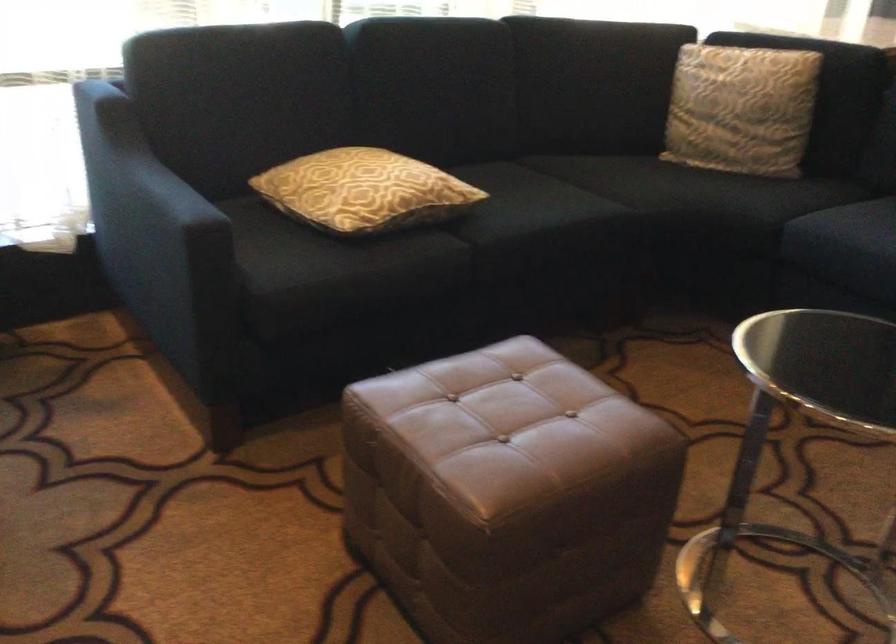
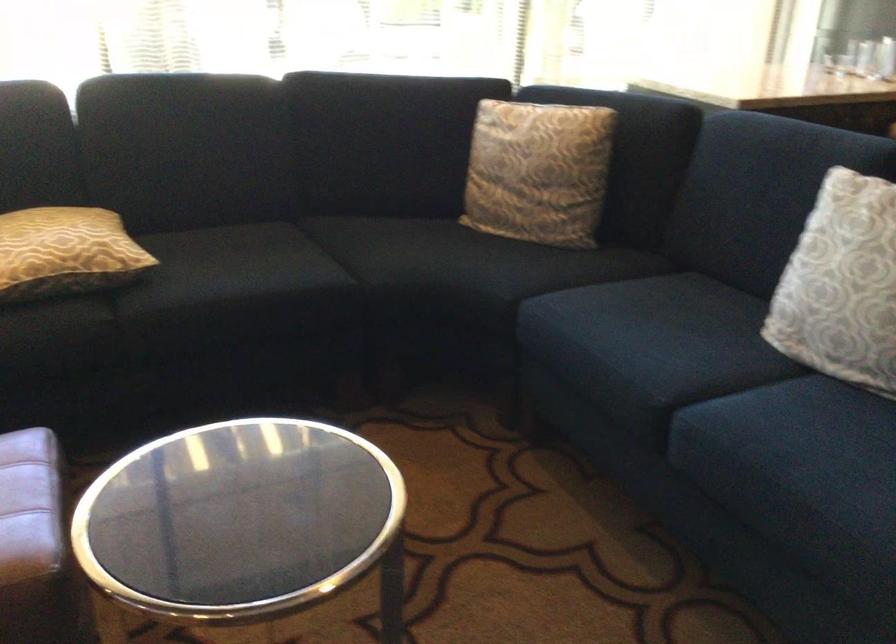
Question: What movement of the cameraman would produce the second image?

Choices:
 (A) Left
 (B) Right
 (C) Forward
 (D) Backward

Answer: (B)